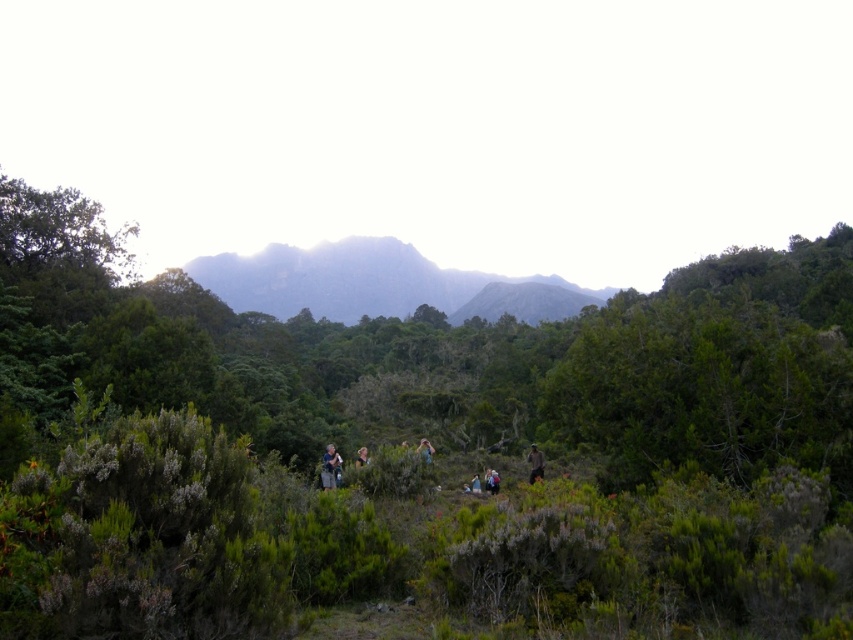
Consider the image. You are a hiker trying to locate a specific green leafy tree in the upper left corner of your map. According to the coordinates provided, where exactly is the green leafy tree at upper left located?

The green leafy tree at upper left is located at coordinates point (59,230).

You are a hiker trying to locate your blue fabric backpack at center. You see a green leafy tree at upper left. Which object is higher in the image?

The green leafy tree at upper left is higher in the image than the blue fabric backpack at center.